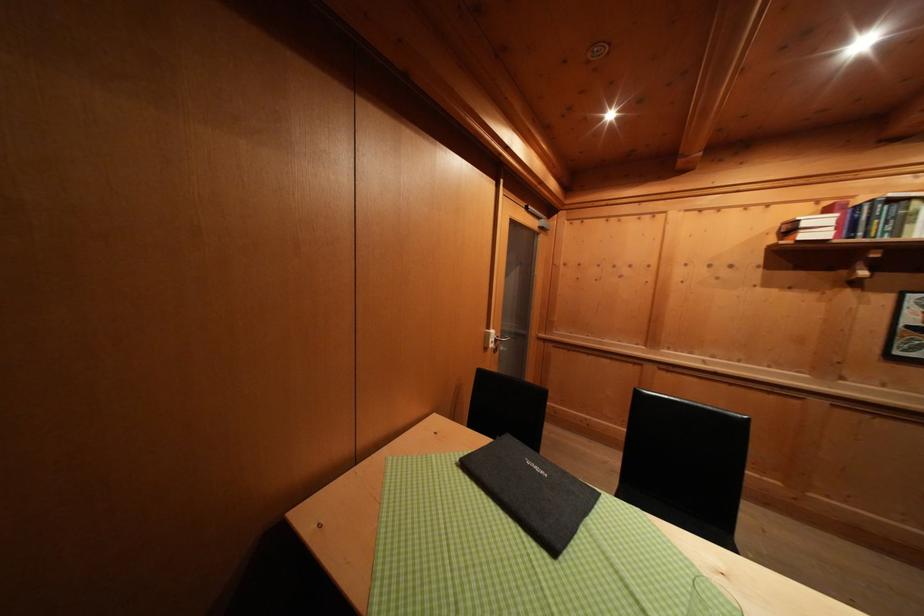
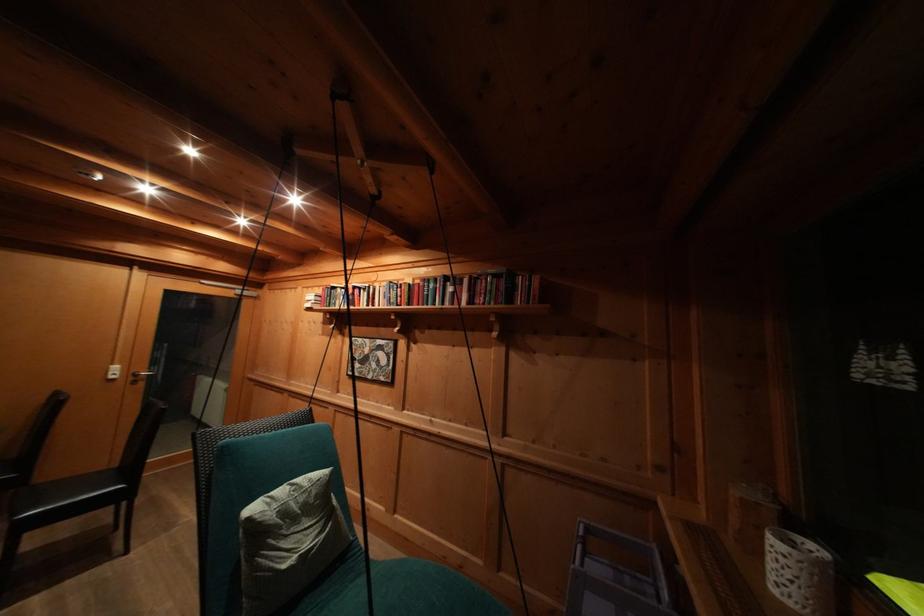
Locate, in the second image, the point that corresponds to pixel 707 216 in the first image.

(313, 293)